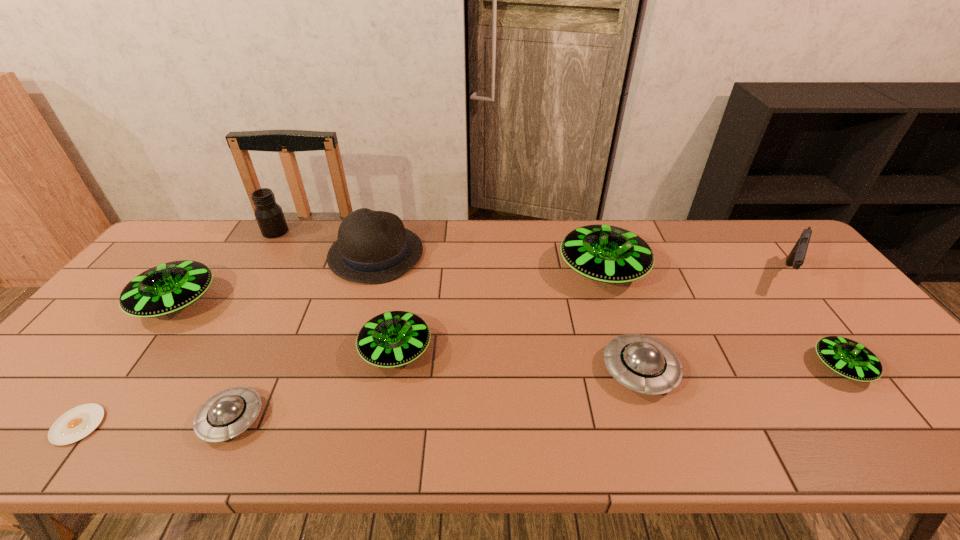
The image size is (960, 540). I want to click on jar, so click(269, 215).

The width and height of the screenshot is (960, 540). Identify the location of bowler hat. (373, 247).

The image size is (960, 540). Find the location of `the biggest green saucer`. the biggest green saucer is located at coordinates (609, 254).

At what (x,y) coordinates should I click in order to perform the action: click on the third green saucer from left to right. Please return your answer as a coordinate pair (x, y). The width and height of the screenshot is (960, 540). Looking at the image, I should click on (609, 254).

Locate an element on the screen. This screenshot has height=540, width=960. gun is located at coordinates (796, 257).

At what (x,y) coordinates should I click in order to perform the action: click on the third smallest green saucer. Please return your answer as a coordinate pair (x, y). Looking at the image, I should click on (167, 288).

This screenshot has width=960, height=540. In order to click on the fifth shortest saucer in this screenshot , I will do `click(167, 288)`.

The image size is (960, 540). Find the location of `the second green saucer from left to right`. the second green saucer from left to right is located at coordinates (392, 339).

This screenshot has width=960, height=540. I want to click on the second smallest green saucer, so click(x=392, y=339).

Find the location of a particular element. This screenshot has height=540, width=960. the bigger gray saucer is located at coordinates (641, 363).